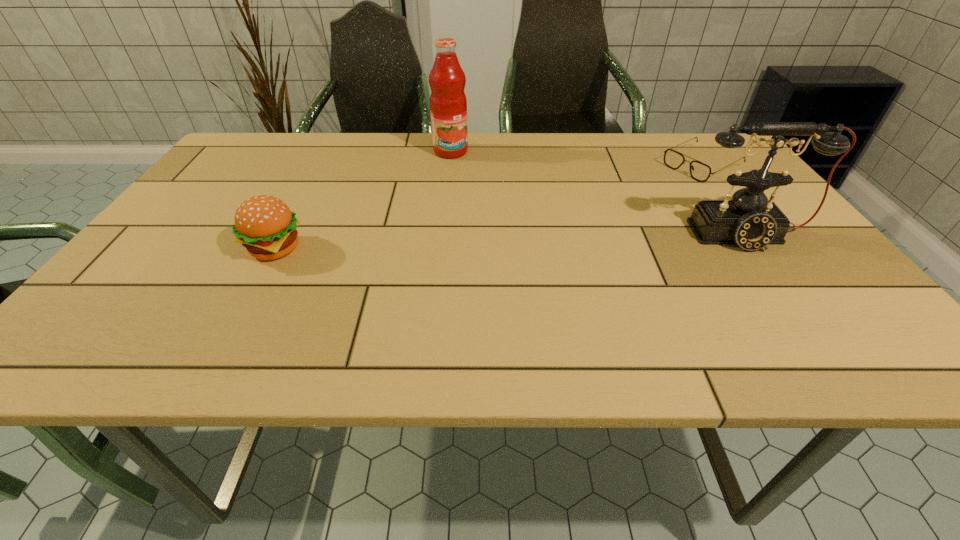
Locate an element on the screen. The height and width of the screenshot is (540, 960). free spot between the second tallest object and the hamburger is located at coordinates (512, 242).

At what (x,y) coordinates should I click in order to perform the action: click on object identified as the third closest to the third shortest object. Please return your answer as a coordinate pair (x, y). The width and height of the screenshot is (960, 540). Looking at the image, I should click on (x=264, y=224).

Select which object appears as the second closest to the telephone. Please provide its 2D coordinates. Your answer should be formatted as a tuple, i.e. [(x, y)], where the tuple contains the x and y coordinates of a point satisfying the conditions above.

[(448, 105)]

Locate an element on the screen. vacant space that satisfies the following two spatial constraints: 1. on the front side of the sunglasses; 2. on the left side of the second object from left to right is located at coordinates (449, 165).